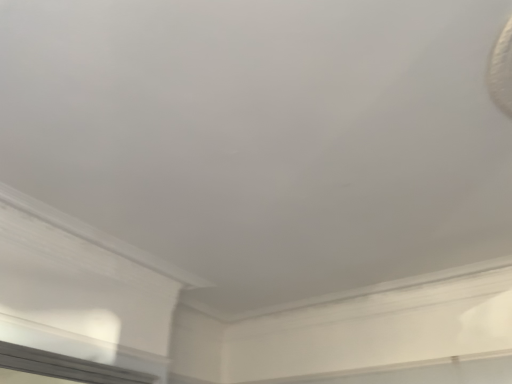
What is the approximate width of clear glass window at lower left?

It is 3.30 inches.

What do you see at coordinates (67, 367) in the screenshot? This screenshot has width=512, height=384. I see `clear glass window at lower left` at bounding box center [67, 367].

The height and width of the screenshot is (384, 512). Find the location of `clear glass window at lower left`. clear glass window at lower left is located at coordinates (67, 367).

I want to click on clear glass window at lower left, so click(67, 367).